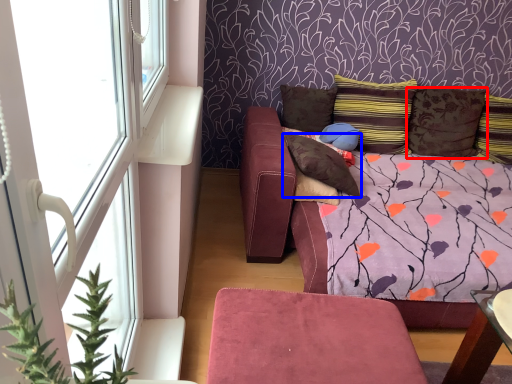
Question: Among these objects, which one is nearest to the camera, pillow (highlighted by a red box) or pillow (highlighted by a blue box)?

Choices:
 (A) pillow
 (B) pillow

Answer: (B)